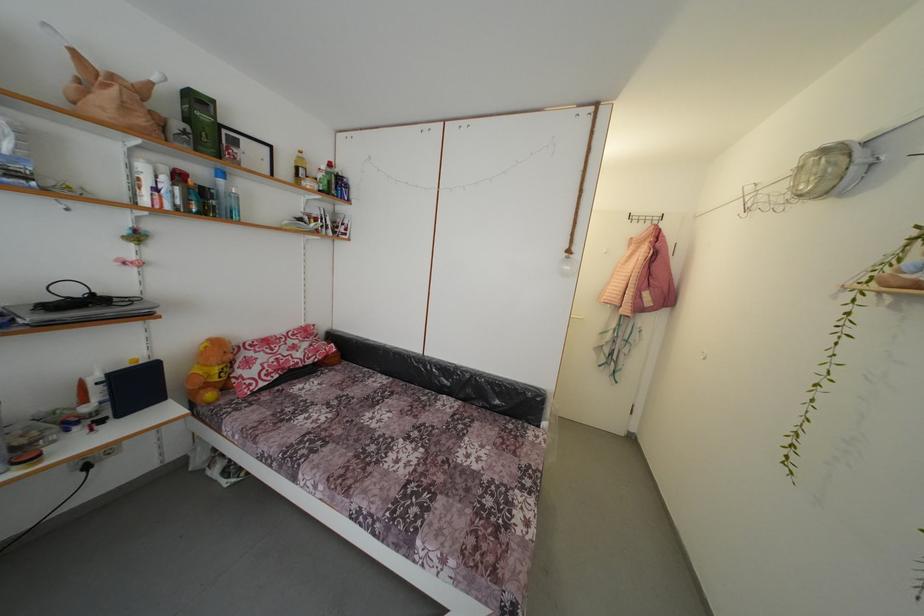
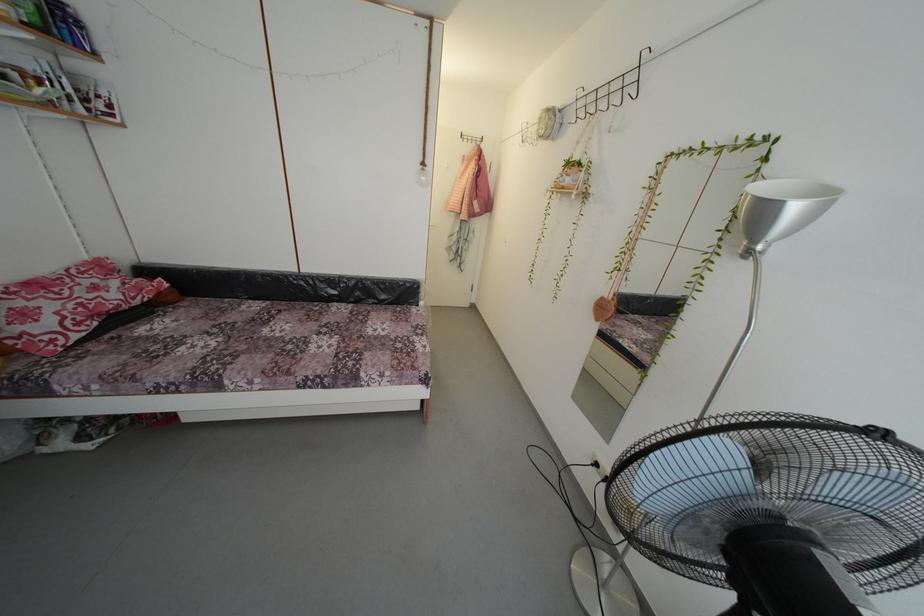
Where in the second image is the point corresponding to point 865,140 from the first image?

(564, 111)